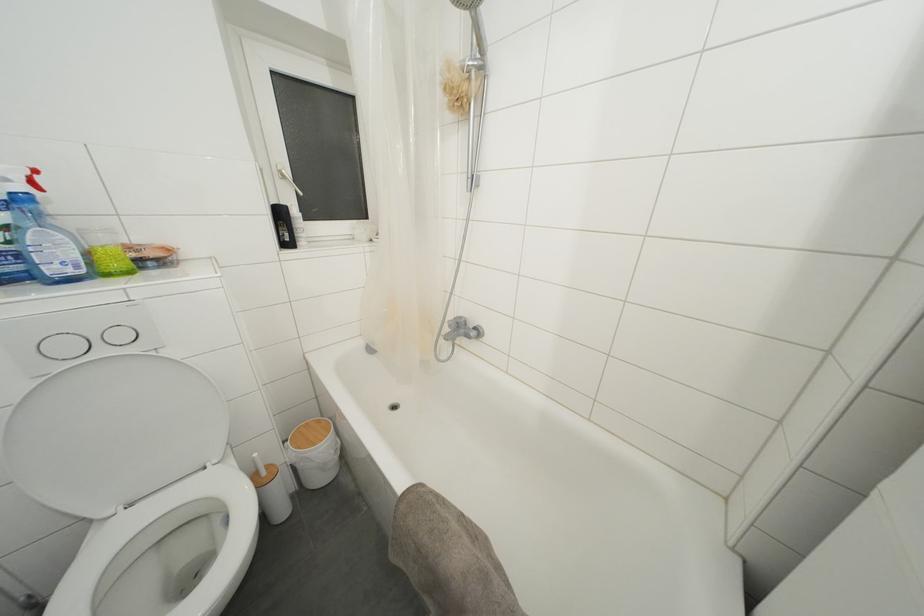
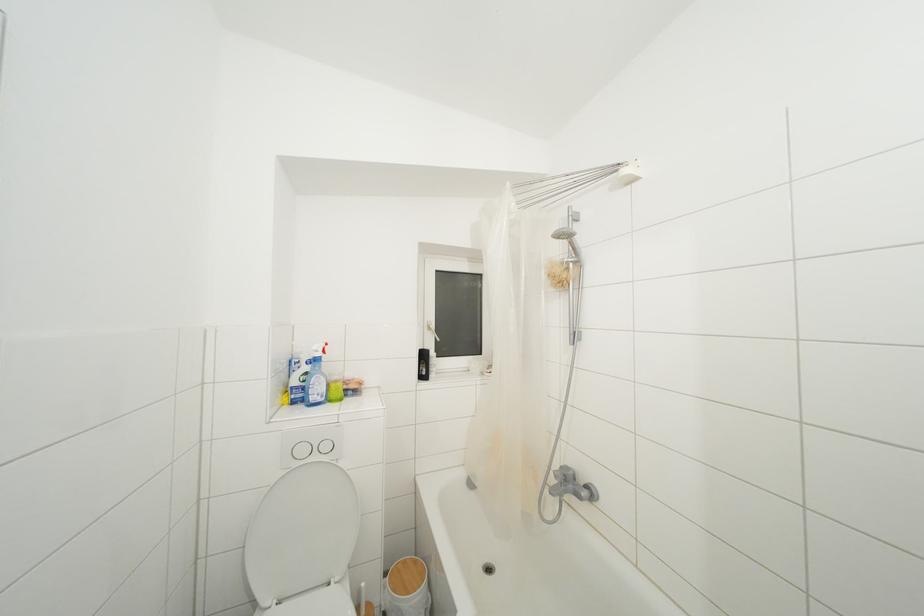
In the second image, find the point that corresponds to (x=106, y=357) in the first image.

(320, 463)